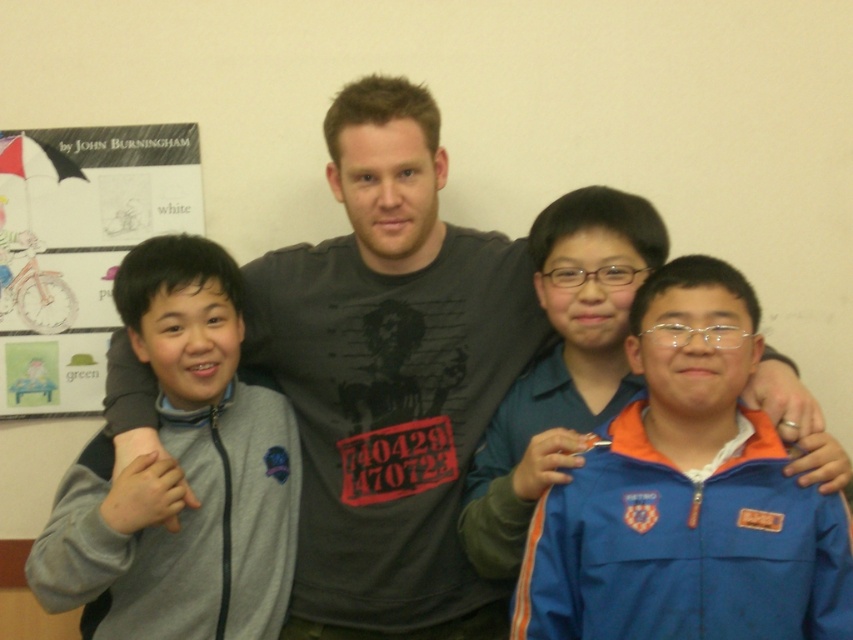
Question: Among these objects, which one is nearest to the camera?

Choices:
 (A) matte gray shirt at center
 (B) gray fleece jacket at left
 (C) blue fabric jacket at lower right
 (D) white paper at upper left

Answer: (C)

Question: In this image, where is gray fleece jacket at left located relative to white paper at upper left?

Choices:
 (A) right
 (B) left

Answer: (A)

Question: Is blue fabric jacket at lower right further to the viewer compared to white paper at upper left?

Choices:
 (A) yes
 (B) no

Answer: (B)

Question: Which point is closer to the camera?

Choices:
 (A) (183, 144)
 (B) (666, 371)
 (C) (227, 580)
 (D) (796, 396)

Answer: (B)

Question: Is blue fabric jacket at lower right below white paper at upper left?

Choices:
 (A) yes
 (B) no

Answer: (A)

Question: Which of the following is the closest to the observer?

Choices:
 (A) 798,540
 (B) 15,148
 (C) 181,467

Answer: (A)